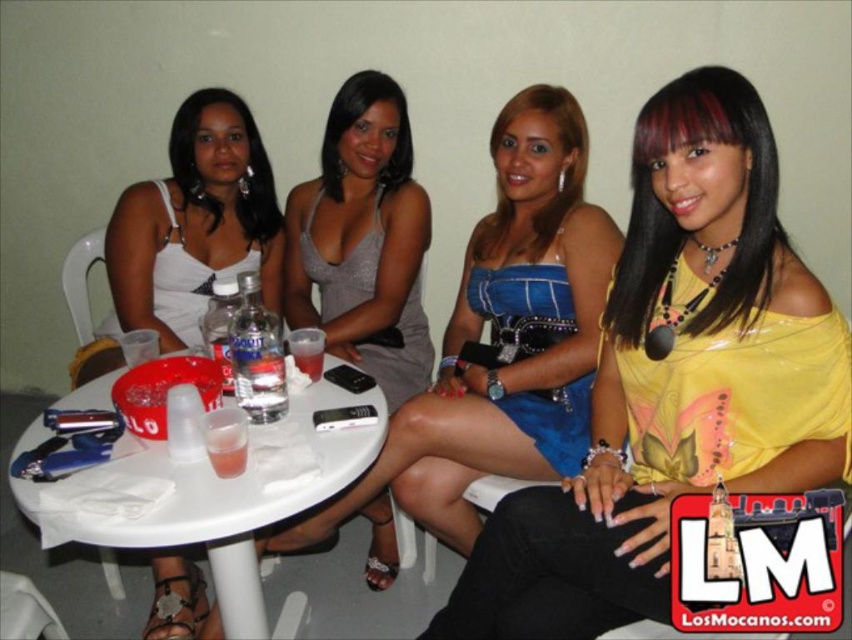
You are organizing a photoshoot and need to decide which of the two items, the yellow shiny blouse at center or the blue satin dress at center, will allow for a wider range of poses without restricting movement. Based on their widths, which item would you choose?

The blue satin dress at center has a greater width than the yellow shiny blouse at center, so it would allow for a wider range of poses without restricting movement.

You are a photographer taking a picture of the yellow shiny blouse at center and the blue satin dress at center. Which one is closer to the camera?

The yellow shiny blouse at center is positioned under the blue satin dress at center, so the blue satin dress at center is closer to the camera.